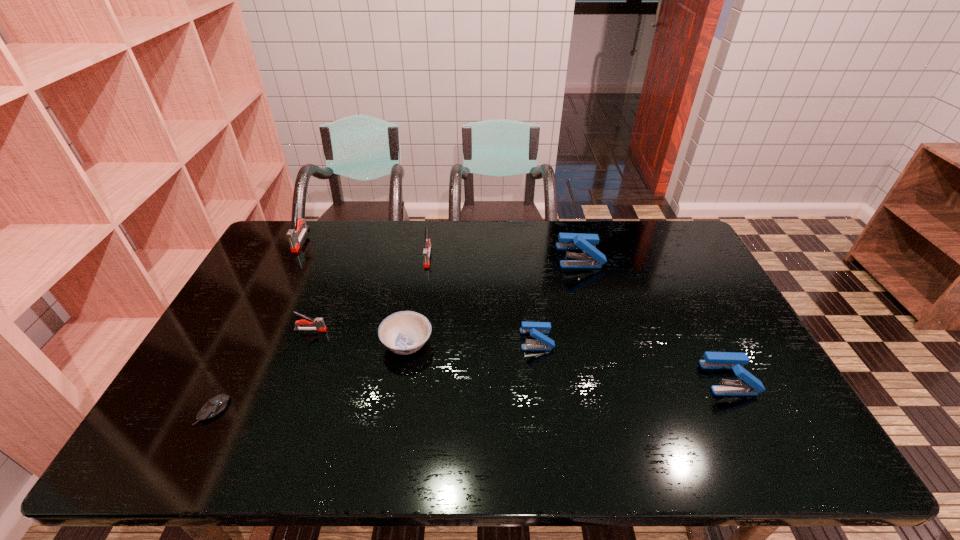
You are a GUI agent. You are given a task and a screenshot of the screen. Output one action in this format:
    pyautogui.click(x=<x>, y=<y>)
    Task: Click on the leftmost blue stapler
    The height and width of the screenshot is (540, 960).
    Given the screenshot: What is the action you would take?
    pyautogui.click(x=537, y=330)

Locate an element on the screen. the smallest blue stapler is located at coordinates (537, 330).

Identify the location of the seventh tallest object. (405, 332).

Image resolution: width=960 pixels, height=540 pixels. Identify the location of bowl. (405, 332).

Locate an element on the screen. computer mouse is located at coordinates (215, 405).

Where is `free spot located on the handle side of the leftmost gray stapler`? The image size is (960, 540). free spot located on the handle side of the leftmost gray stapler is located at coordinates (290, 261).

This screenshot has width=960, height=540. What are the coordinates of `blank space located 0.390m on the left of the farthest blue stapler` in the screenshot? It's located at click(445, 256).

Where is `free space located on the handle side of the rightmost gray stapler`? free space located on the handle side of the rightmost gray stapler is located at coordinates (423, 288).

Identify the location of free space located on the back of the rightmost object. (678, 278).

Where is `vacant space located on the handle side of the smallest gray stapler`? The image size is (960, 540). vacant space located on the handle side of the smallest gray stapler is located at coordinates pos(382,330).